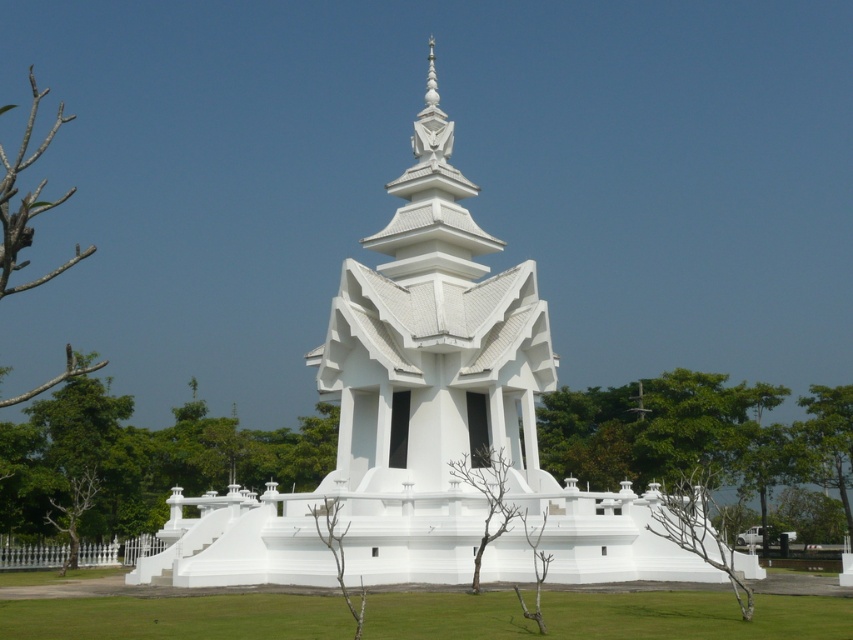
Question: Can you confirm if green grass at lower center is positioned above green leafy tree at right?

Choices:
 (A) yes
 (B) no

Answer: (A)

Question: Among these points, which one is farthest from the camera?

Choices:
 (A) (270, 602)
 (B) (0, 515)

Answer: (B)

Question: Which point is closer to the camera taking this photo?

Choices:
 (A) (47, 381)
 (B) (281, 467)
 (C) (546, 417)

Answer: (B)

Question: Does green grass at lower center have a larger size compared to green leafy tree at right?

Choices:
 (A) yes
 (B) no

Answer: (B)

Question: Which of these objects is positioned closest to the green grass at lower center?

Choices:
 (A) green leafy tree at right
 (B) green leafy tree at lower left

Answer: (B)

Question: Is green grass at lower center thinner than green leafy tree at right?

Choices:
 (A) yes
 (B) no

Answer: (B)